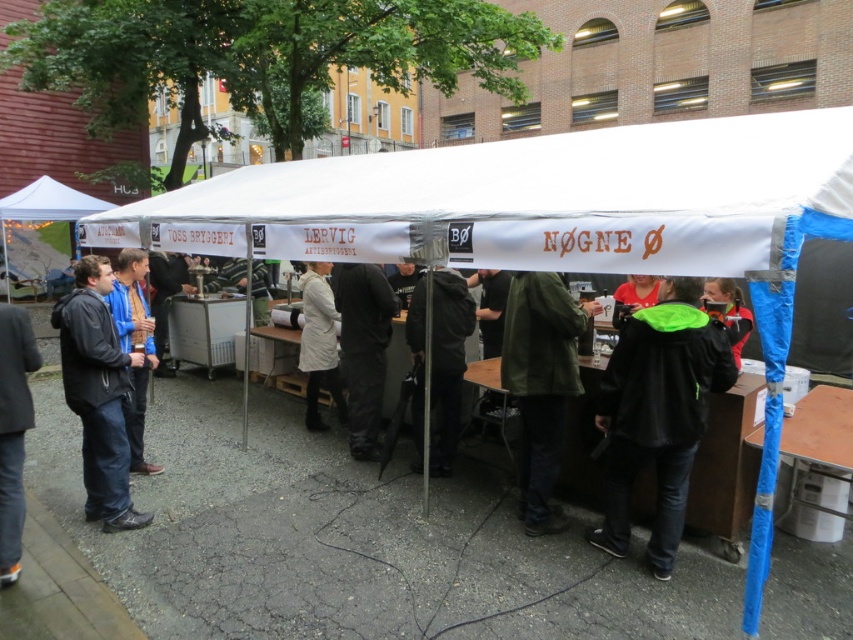
Question: Which of these objects is positioned farthest from the white fabric canopy at center?

Choices:
 (A) blue fabric jacket at left
 (B) dark gray suit at left
 (C) green matte jacket at center
 (D) black matte jacket at lower right

Answer: (B)

Question: Which of the following is the farthest from the observer?

Choices:
 (A) [x=0, y=522]
 (B) [x=633, y=444]

Answer: (B)

Question: Where is green matte jacket at center located in relation to black fabric jacket at center in the image?

Choices:
 (A) above
 (B) below

Answer: (B)

Question: Is the position of dark gray fabric jacket at center more distant than that of dark gray suit at left?

Choices:
 (A) yes
 (B) no

Answer: (A)

Question: Which is farther from the dark gray jacket at left?

Choices:
 (A) green matte jacket at center
 (B) light beige coat at center
 (C) black fabric jacket at center

Answer: (A)

Question: Is dark gray jacket at left above black fabric jacket at center?

Choices:
 (A) yes
 (B) no

Answer: (B)